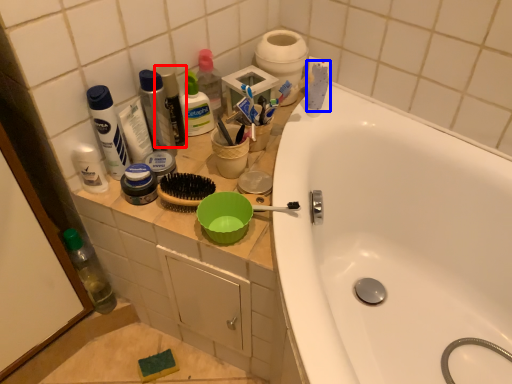
Question: Which object appears farthest to the camera in this image, mouthwash (highlighted by a red box) or toothpaste (highlighted by a blue box)?

Choices:
 (A) mouthwash
 (B) toothpaste

Answer: (B)